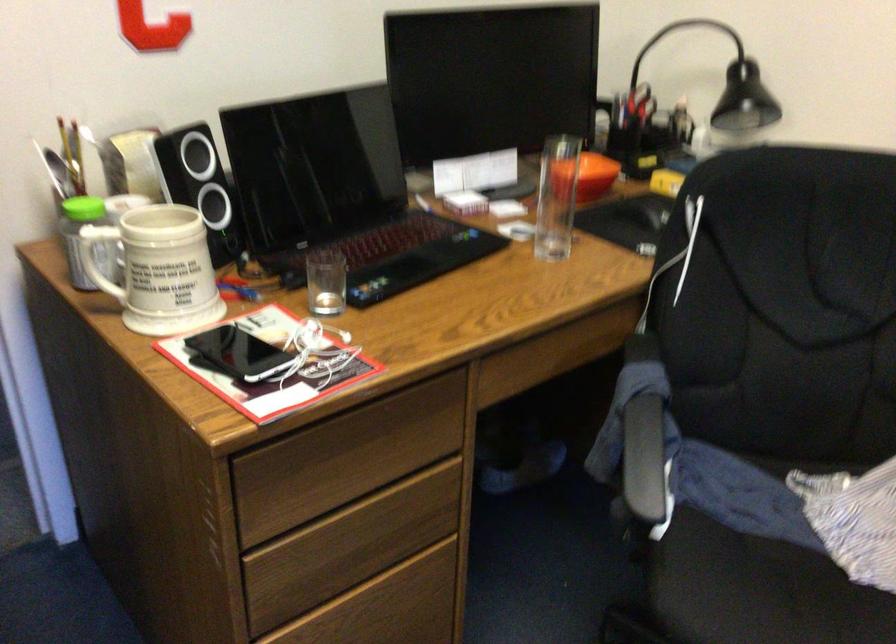
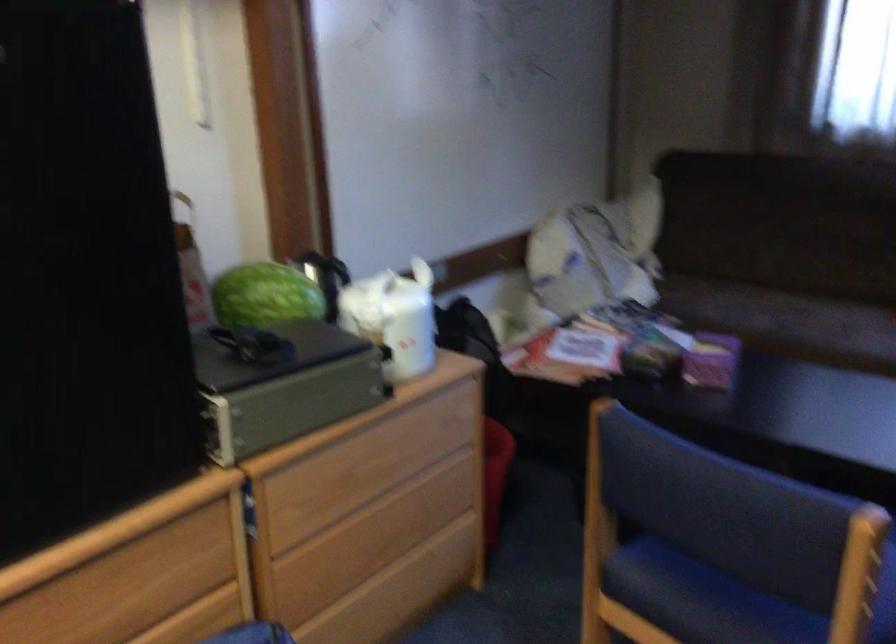
How did the camera likely rotate?

The camera's rotation is toward right-down.